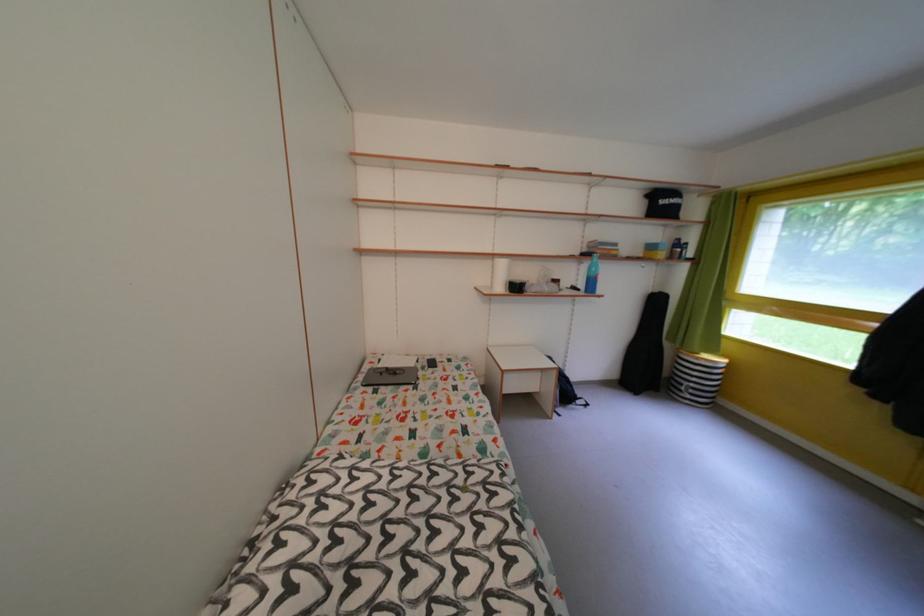
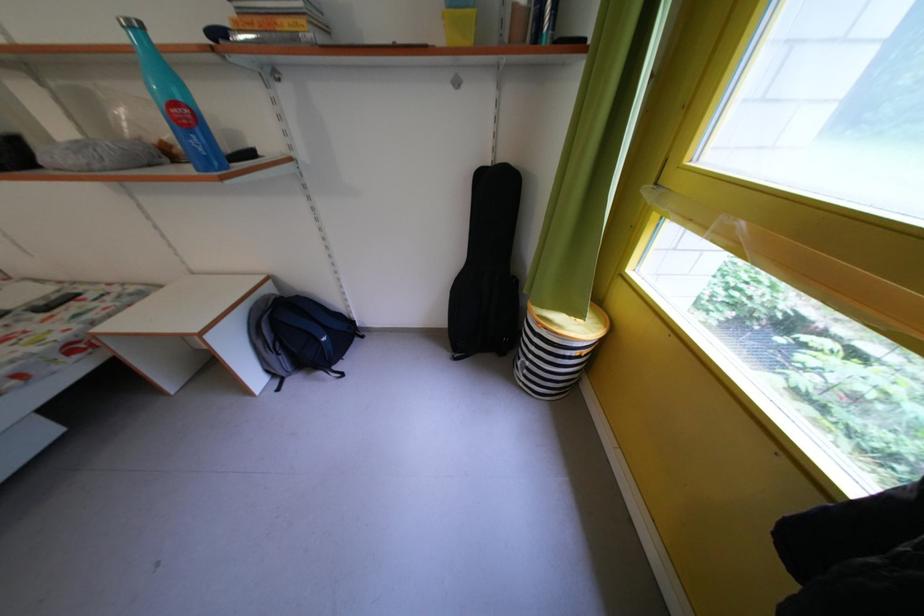
Find the pixel in the second image that matches pixel 700 391 in the first image.

(537, 369)